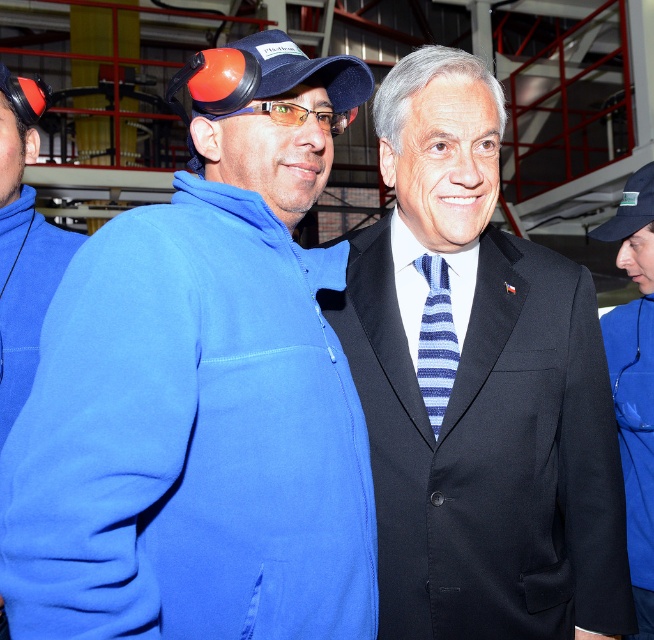
You are a safety inspector in this industrial setting. You need to ensure that the blue fleece jacket at left and the orange plastic goggles at center are within a 15 inch safety zone. Can you confirm if they are within the required distance?

The distance between the blue fleece jacket at left and the orange plastic goggles at center is 14.67 inches, which is within the 15 inch safety zone requirement.

You are a photographer standing 3 feet away from the two people in the image. You want to take a photo that includes both the matte blue baseball cap at center and the blue striped tie at center without any part of them being cut off. What is the minimum width of the camera lens you need to use?

The distance between the matte blue baseball cap at center and the blue striped tie at center is 20.08 inches. Since you are 3 feet away, which is 36 inches, the minimum width of the camera lens should be at least 20.08 inches to capture both objects without cropping.

You are a photographer trying to capture a clear photo of the blue striped tie at center without the matte blue baseball cap at center blocking it. Is this possible given their positions?

The matte blue baseball cap at center is in front of the blue striped tie at center, so it would block the view. Move the camera angle to the side or have the person adjust their position to avoid the obstruction.